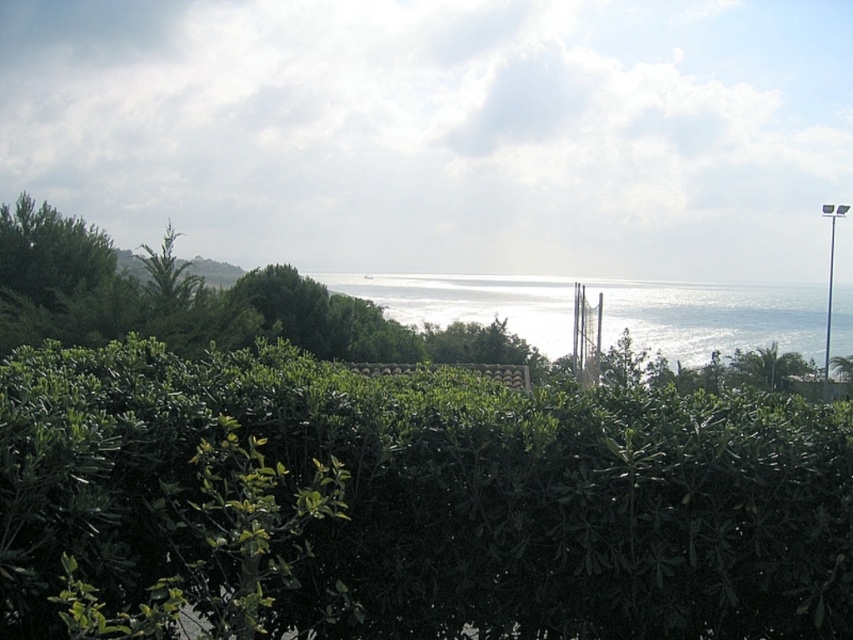
In the scene shown: Between green leafy hedge at center and glistening silver water at center, which one is positioned higher?

glistening silver water at center

Consider the image. Is green leafy hedge at center smaller than glistening silver water at center?

Yes, green leafy hedge at center is smaller than glistening silver water at center.

At what (x,y) coordinates should I click in order to perform the action: click on green leafy hedge at center. Please return your answer as a coordinate pair (x, y). Looking at the image, I should click on (410, 502).